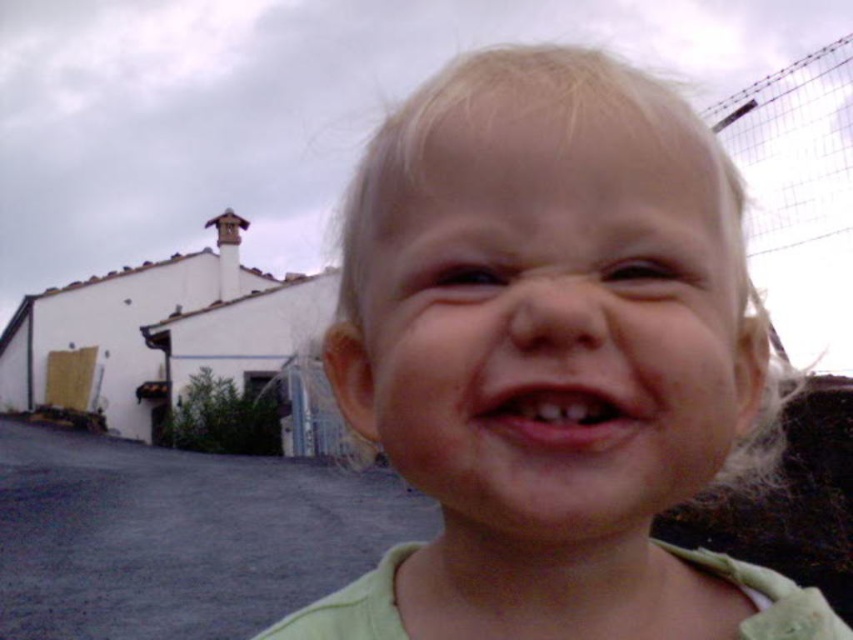
Question: Does light blonde hair at center appear over pink flesh at center?

Choices:
 (A) yes
 (B) no

Answer: (B)

Question: Which point appears farthest from the camera in this image?

Choices:
 (A) (688, 401)
 (B) (437, 426)
 (C) (560, 384)

Answer: (A)

Question: Can you confirm if light blonde hair at center is positioned above pale skin at center?

Choices:
 (A) no
 (B) yes

Answer: (A)

Question: Can you confirm if pale skin at center is positioned to the left of pink flesh at center?

Choices:
 (A) no
 (B) yes

Answer: (A)

Question: Which object is farther from the camera taking this photo?

Choices:
 (A) pale skin at center
 (B) pink flesh at center
 (C) light blonde hair at center

Answer: (B)

Question: Estimate the real-world distances between objects in this image. Which object is farther from the light blonde hair at center?

Choices:
 (A) pink flesh at center
 (B) pale skin at center

Answer: (A)